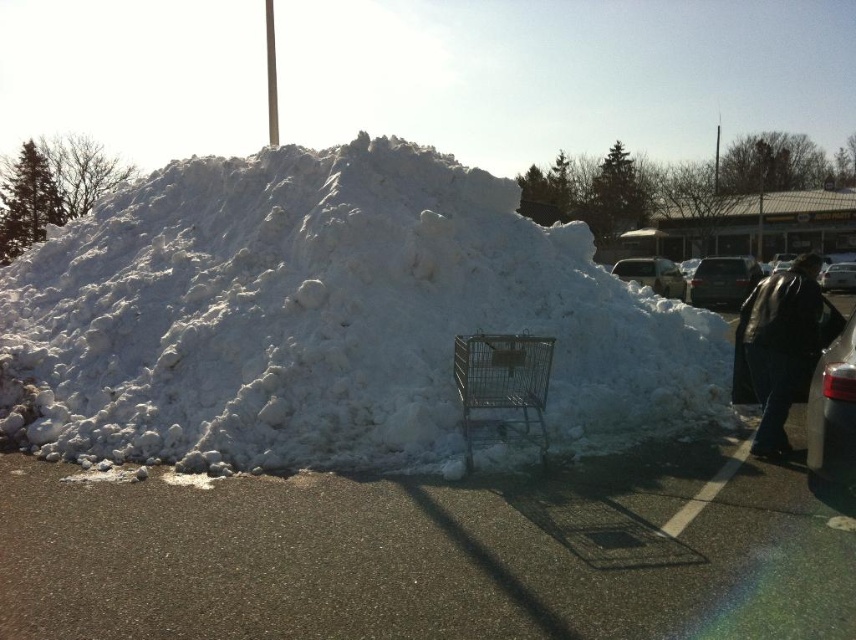
You are a delivery person who needs to find a place to park your shiny silver car at right. You see a black leather jacket at lower right nearby. Which object is taller and could potentially block your parking spot?

The black leather jacket at lower right is taller than the shiny silver car at right, so it could potentially block the parking spot.